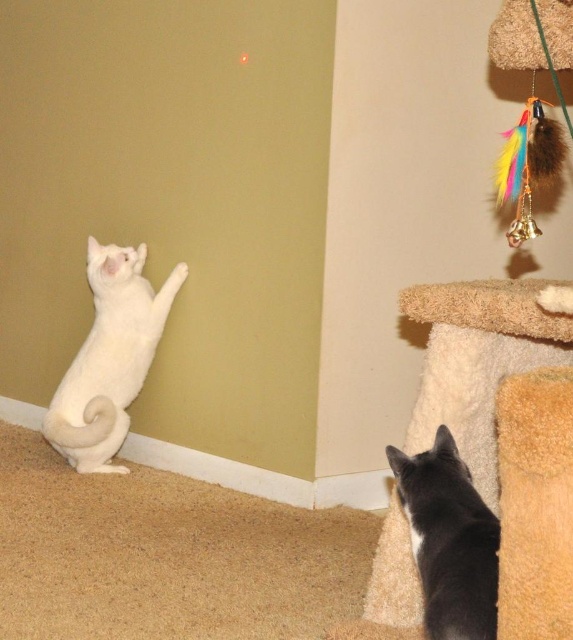
Describe the element at coordinates (109, 356) in the screenshot. I see `white fur cat at left` at that location.

Where is `white fur cat at left`? white fur cat at left is located at coordinates (109, 356).

Identify the location of white fur cat at left. (109, 356).